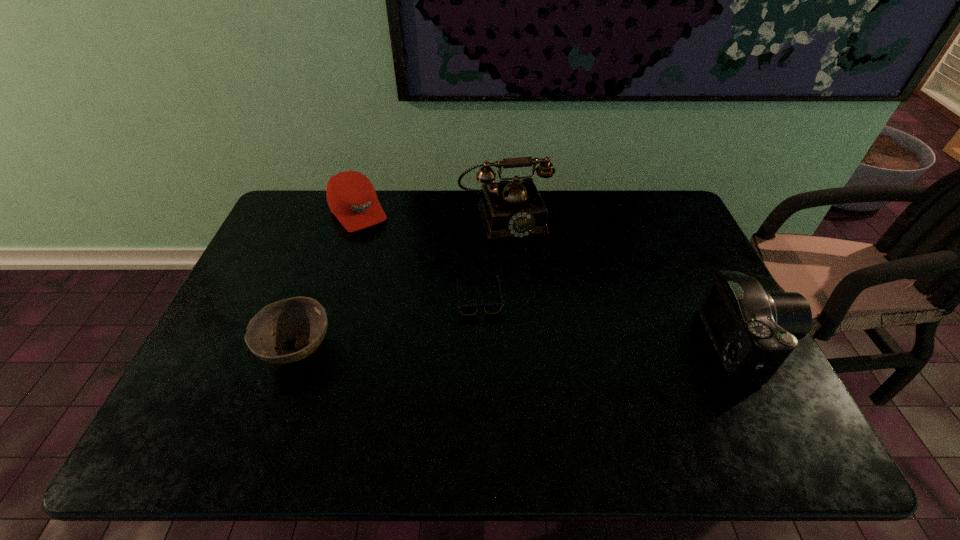
The width and height of the screenshot is (960, 540). I want to click on the second shortest object, so click(x=304, y=318).

Locate an element on the screen. This screenshot has height=540, width=960. camera is located at coordinates (754, 331).

At what (x,y) coordinates should I click in order to perform the action: click on the rightmost object. Please return your answer as a coordinate pair (x, y). This screenshot has height=540, width=960. Looking at the image, I should click on (754, 331).

The image size is (960, 540). Find the location of `the tallest object`. the tallest object is located at coordinates (509, 209).

Locate an element on the screen. The width and height of the screenshot is (960, 540). the third shortest object is located at coordinates (351, 197).

Locate an element on the screen. sunglasses is located at coordinates (490, 308).

The image size is (960, 540). What are the coordinates of `vacant region located 0.140m on the right of the fourth tallest object` in the screenshot? It's located at (390, 348).

This screenshot has width=960, height=540. I want to click on free space located on the dial of the tallest object, so click(518, 254).

Where is `free space located 0.140m on the dial of the tallest object`? The image size is (960, 540). free space located 0.140m on the dial of the tallest object is located at coordinates pyautogui.click(x=524, y=272).

Locate an element on the screen. The height and width of the screenshot is (540, 960). vacant space situated 0.260m on the dial of the tallest object is located at coordinates (535, 302).